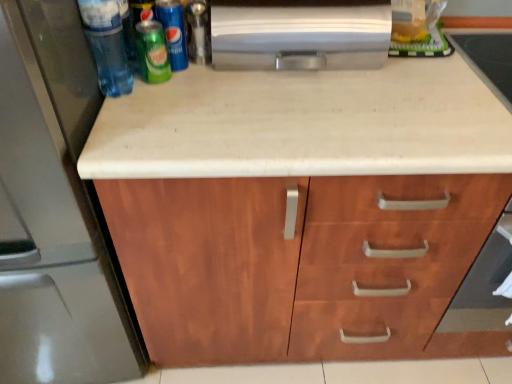
Locate an element on the screen. The width and height of the screenshot is (512, 384). free space in front of green matte pepsi can at upper left, acting as the 1th beer starting from the right is located at coordinates (179, 108).